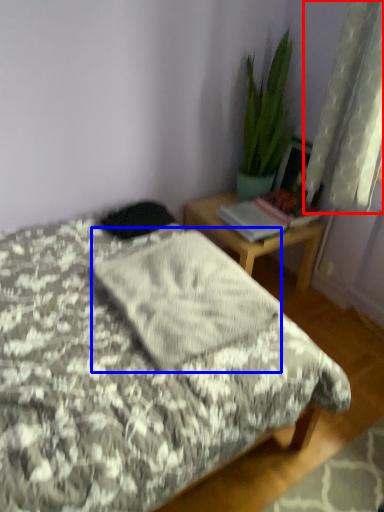
Question: Which object appears farthest to the camera in this image, curtain (highlighted by a red box) or blanket (highlighted by a blue box)?

Choices:
 (A) curtain
 (B) blanket

Answer: (A)